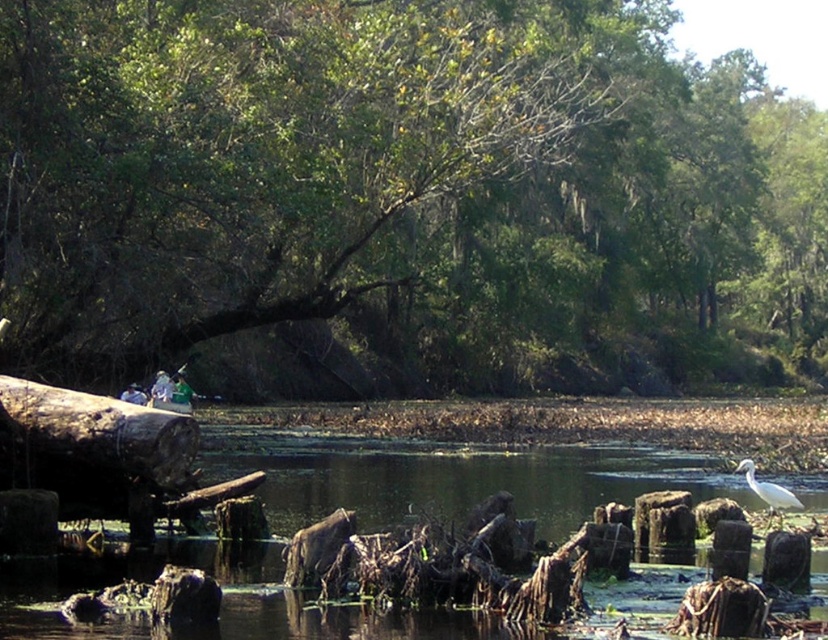
You are standing at the center of the swamp and want to locate the green leafy tree at upper center. Based on the coordinates provided, in which direction should you look to find it?

The green leafy tree at upper center is located at coordinates point [402,198], which corresponds to the upper center direction from your current position at the center of the swamp.

You are a photographer trying to capture a wide shot of the green leafy tree at upper center and the rough wooden log at left in the same frame. Given that your camera has a 50mm lens, which has a field of view of approximately 46 degrees, can you estimate if both objects will fit in the frame from your current position?

The green leafy tree at upper center and rough wooden log at left are 35.04 meters apart. With a 50mm lens providing a 46 degree field of view, the maximum distance between two objects that can be captured in the same frame depends on the distance from the camera to the subjects. Without knowing the exact distance to the objects, it is impossible to definitively determine if they will fit. However, if the photographer is positioned at a sufficient distance where both objects are within the 46 degree angle,

You are standing at the edge of the swamp and want to reach the point marked at coordinates (145, 472). Given that the water here is calm and the submerged stumps are spaced 2 meters apart, can you safely walk to that point without getting your feet wet?

The point at coordinates (145, 472) is 13.14 meters away from the viewer. Since the submerged stumps are spaced 2 meters apart, you can step on them to safely reach the point without getting your feet wet.